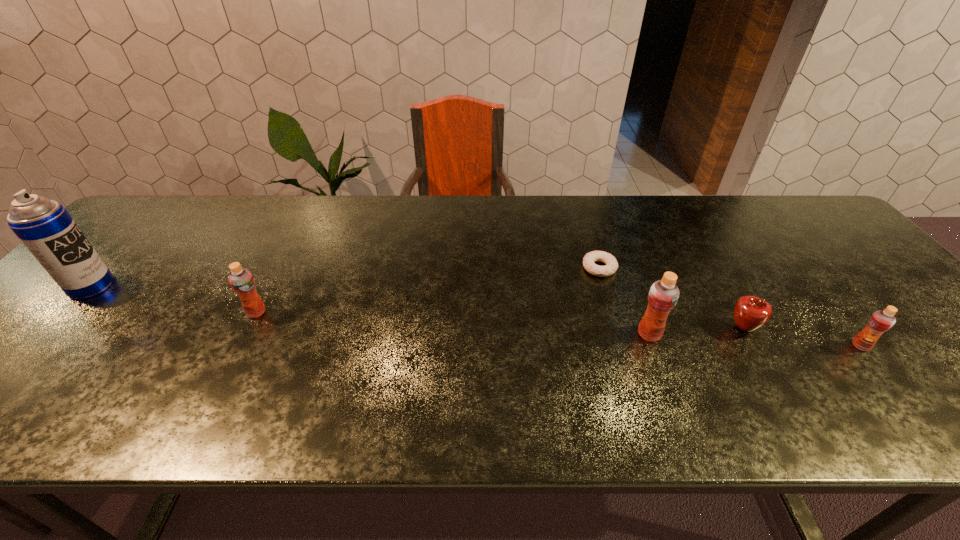
The height and width of the screenshot is (540, 960). Identify the location of the tallest object. (44, 226).

Identify the location of free space located on the front of the fourth shortest object. The width and height of the screenshot is (960, 540). (231, 361).

This screenshot has height=540, width=960. What are the coordinates of `blank space located on the front of the second tallest object` in the screenshot? It's located at (665, 377).

The width and height of the screenshot is (960, 540). Find the location of `free location located 0.330m on the left of the rightmost orange juice`. free location located 0.330m on the left of the rightmost orange juice is located at coordinates (705, 346).

Find the location of a particular element. This screenshot has height=540, width=960. vacant space situated 0.080m on the front of the shortest object is located at coordinates (610, 301).

The image size is (960, 540). What are the coordinates of `free space located 0.170m on the back of the fifth tallest object` in the screenshot? It's located at (709, 271).

The height and width of the screenshot is (540, 960). I want to click on vacant space located 0.310m on the label side of the tallest object, so click(x=232, y=286).

Find the location of `object located at the left edge`. object located at the left edge is located at coordinates (44, 226).

The width and height of the screenshot is (960, 540). In the image, there is a desktop. What are the coordinates of `vacant space at the far edge` in the screenshot? It's located at (495, 204).

In the image, there is a desktop. At what (x,y) coordinates should I click in order to perform the action: click on free space at the near edge. Please return your answer as a coordinate pair (x, y). Looking at the image, I should click on (191, 381).